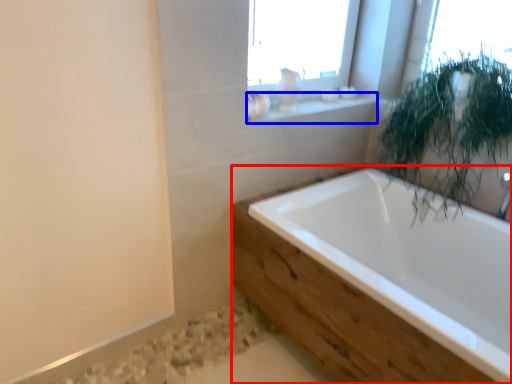
Question: Which object appears closest to the camera in this image, bathtub (highlighted by a red box) or window sill (highlighted by a blue box)?

Choices:
 (A) bathtub
 (B) window sill

Answer: (A)